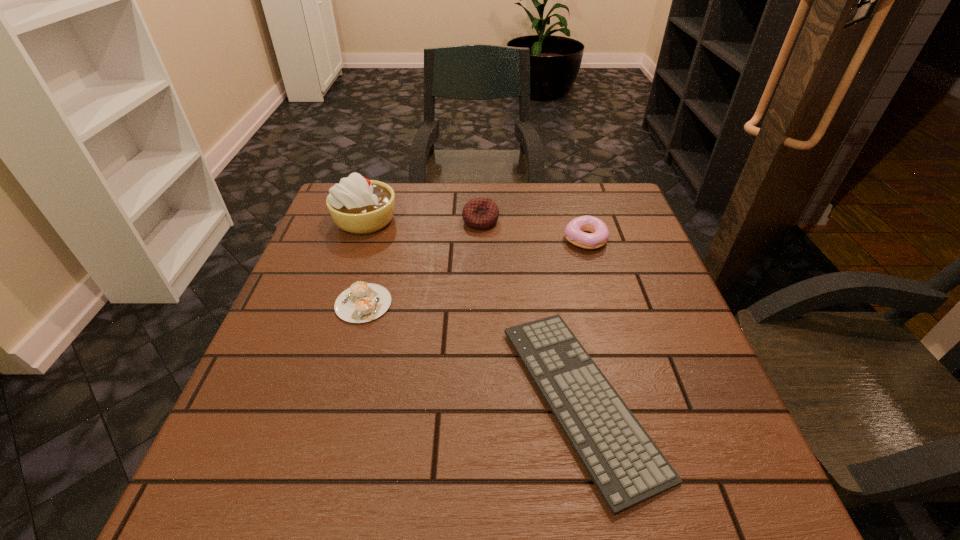
Where is `vacant space in between the beanbag and the fourth tallest object`? vacant space in between the beanbag and the fourth tallest object is located at coordinates (422, 262).

Find the location of a particular element. The image size is (960, 540). vacant point located between the second shortest object and the tallest object is located at coordinates (365, 261).

This screenshot has width=960, height=540. Find the location of `blank region between the second tallest object and the cappuccino`. blank region between the second tallest object and the cappuccino is located at coordinates (422, 262).

The height and width of the screenshot is (540, 960). Identify the location of vacant space that is in between the beanbag and the tallest object. (423, 220).

Find the location of a particular element. vacant region between the beanbag and the second shortest object is located at coordinates (422, 262).

This screenshot has width=960, height=540. Identify the location of vacant area that lies between the fourth tallest object and the whipped cream. (365, 261).

This screenshot has height=540, width=960. I want to click on vacant area that lies between the doughnut and the second shortest object, so click(x=474, y=272).

Identify the location of object that is the closest to the shortest object. This screenshot has width=960, height=540. (575, 230).

Locate which object ranks third in proximity to the third tallest object. Please provide its 2D coordinates. Your answer should be formatted as a tuple, i.e. [(x, y)], where the tuple contains the x and y coordinates of a point satisfying the conditions above.

[(363, 302)]

At what (x,y) coordinates should I click in order to perform the action: click on free region that satisfies the following two spatial constraints: 1. on the back side of the cappuccino; 2. on the right side of the beanbag. Please return your answer as a coordinate pair (x, y). This screenshot has width=960, height=540. Looking at the image, I should click on (386, 221).